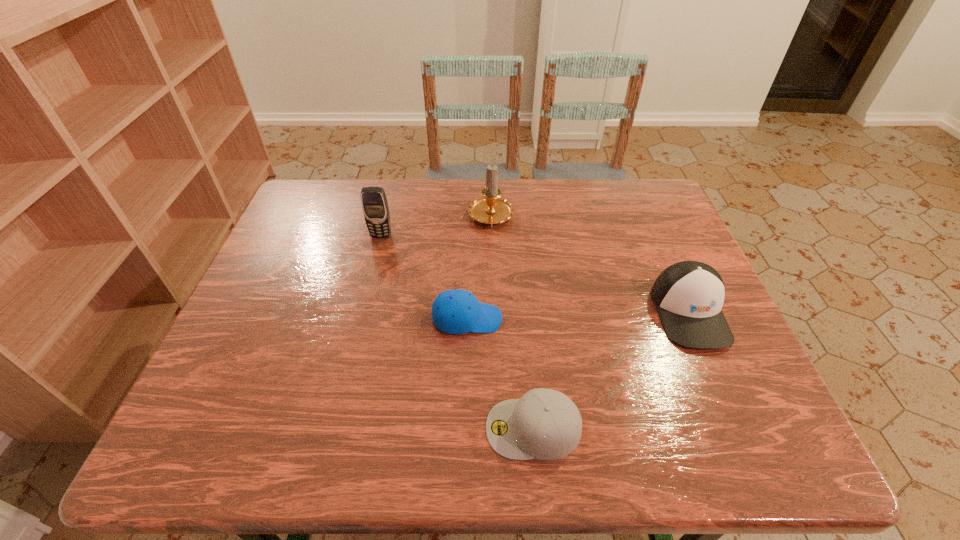
Locate an element on the screen. The width and height of the screenshot is (960, 540). free space that satisfies the following two spatial constraints: 1. on the front panel of the third tallest object; 2. on the front-facing side of the nearest cap is located at coordinates tap(740, 428).